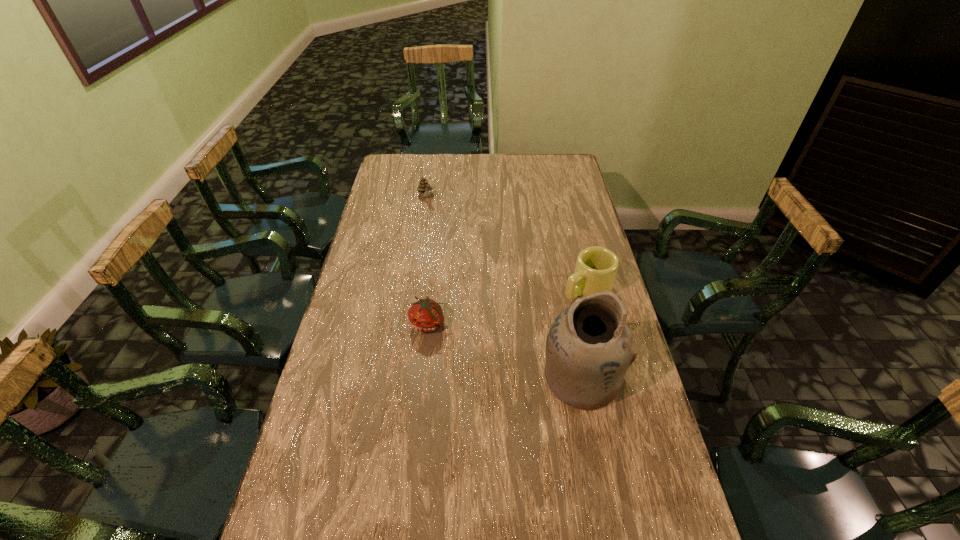
You are a GUI agent. You are given a task and a screenshot of the screen. Output one action in this format:
    pyautogui.click(x=<x>, y=<y>)
    Task: Click on the vacant spot on the desktop that is between the tomato and the tallest object and is positioned on the face of the farthest object
    The width and height of the screenshot is (960, 540).
    Given the screenshot: What is the action you would take?
    pyautogui.click(x=505, y=350)

Image resolution: width=960 pixels, height=540 pixels. Find the location of `free spot on the desktop that is between the tomato and the tallest object and is positioned with the handle on the side of the third nearest object`. free spot on the desktop that is between the tomato and the tallest object and is positioned with the handle on the side of the third nearest object is located at coordinates (492, 346).